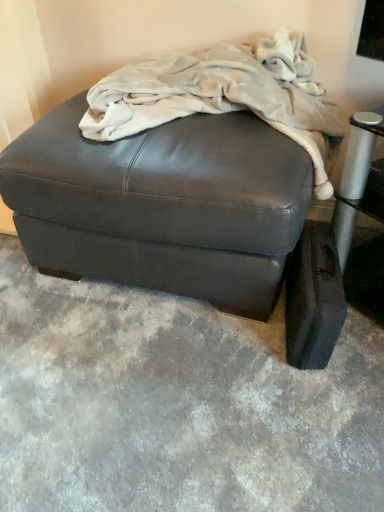
Question: Is point (14, 198) closer or farther from the camera than point (309, 368)?

Choices:
 (A) closer
 (B) farther

Answer: (B)

Question: Relative to leather ottoman at lower right, is matte black ottoman at center in front or behind?

Choices:
 (A) behind
 (B) front

Answer: (B)

Question: Considering the real-world distances, which object is farthest from the matte black ottoman at center?

Choices:
 (A) fuzzy white blanket at upper center
 (B) leather ottoman at lower right

Answer: (B)

Question: Which object is positioned closest to the fuzzy white blanket at upper center?

Choices:
 (A) leather ottoman at lower right
 (B) matte black ottoman at center

Answer: (B)